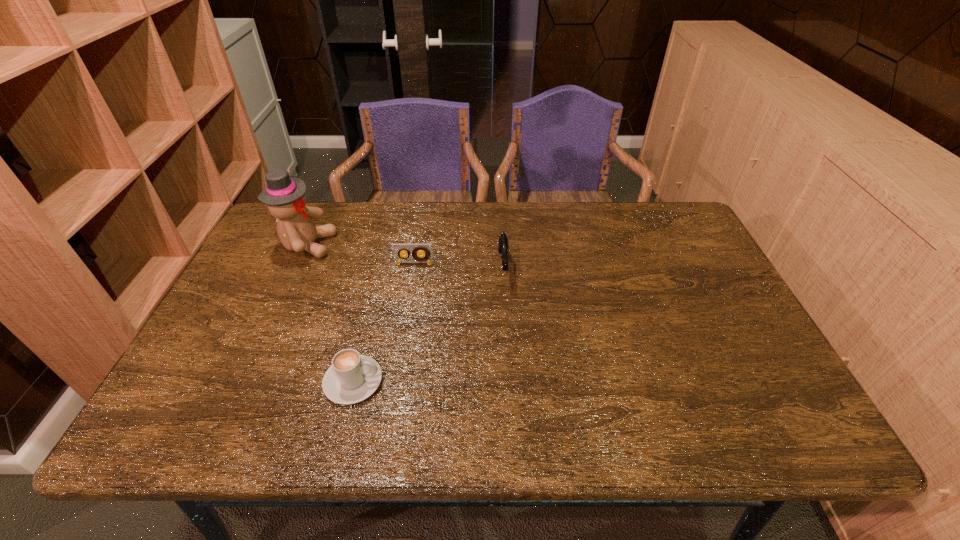
You are a GUI agent. You are given a task and a screenshot of the screen. Output one action in this format:
    pyautogui.click(x=<x>, y=<y>)
    Task: Click on the tallest object
    
    Given the screenshot: What is the action you would take?
    pyautogui.click(x=285, y=196)

This screenshot has height=540, width=960. Find the location of `rag_doll`. rag_doll is located at coordinates (285, 196).

Image resolution: width=960 pixels, height=540 pixels. What are the coordinates of `gun` in the screenshot? It's located at (503, 240).

The height and width of the screenshot is (540, 960). Identify the location of the rightmost object. (503, 240).

The width and height of the screenshot is (960, 540). In order to click on the nearest object in this screenshot , I will do `click(351, 378)`.

The image size is (960, 540). Find the location of `videotape`. videotape is located at coordinates (397, 249).

Locate an element on the screen. Image resolution: width=960 pixels, height=540 pixels. free space located on the front-facing side of the leftmost object is located at coordinates (353, 245).

Image resolution: width=960 pixels, height=540 pixels. Find the location of `vacant space situated 0.110m at the end of the barrel of the rightmost object`. vacant space situated 0.110m at the end of the barrel of the rightmost object is located at coordinates (506, 321).

Locate an element on the screen. This screenshot has width=960, height=540. vacant area located 0.160m to the right of the cappuccino is located at coordinates (454, 381).

Find the location of a particular element. The height and width of the screenshot is (540, 960). vacant space situated 0.240m at the front of the videotape with visible reels is located at coordinates (403, 330).